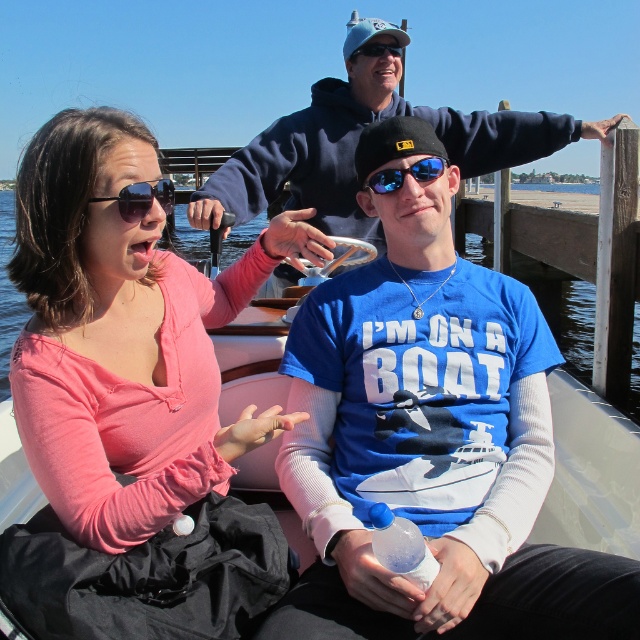
Question: In this image, where is blue t-shirt at center located relative to white plastic boat at center?

Choices:
 (A) right
 (B) left

Answer: (B)

Question: Which point appears closest to the camera in this image?

Choices:
 (A) (340, 164)
 (B) (253, 384)
 (C) (353, 61)
 (D) (406, 168)

Answer: (D)

Question: Which point is farther from the camera taking this photo?

Choices:
 (A) (113, 545)
 (B) (392, 170)
 (C) (592, 353)

Answer: (C)

Question: Considering the real-world distances, which object is closest to the blue reflective sunglasses at upper center?

Choices:
 (A) blue t-shirt at center
 (B) white plastic boat at center
 (C) clear water at center
 (D) translucent plastic bottle at center

Answer: (B)

Question: Can you confirm if pink fabric shirt at left is wider than blue cotton shirt at upper center?

Choices:
 (A) no
 (B) yes

Answer: (A)

Question: Can you confirm if translucent plastic bottle at center is wider than blue reflective sunglasses at center?

Choices:
 (A) no
 (B) yes

Answer: (A)